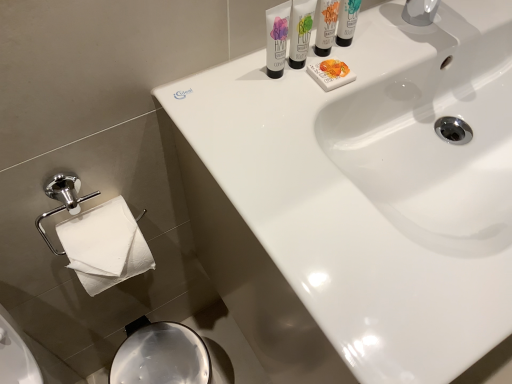
What are the coordinates of `free space behind white matte soap at upper center` in the screenshot? It's located at (357, 34).